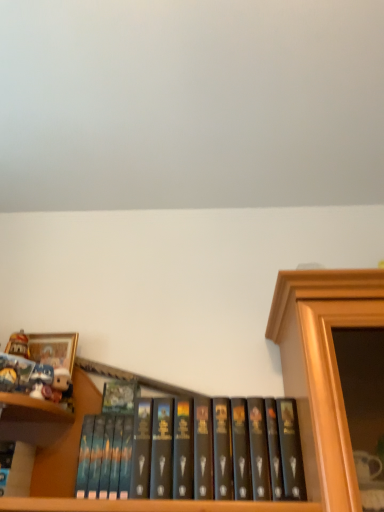
Question: Is matte white plush toy at upper left situated inside gold-framed picture at upper left or outside?

Choices:
 (A) outside
 (B) inside

Answer: (A)

Question: Would you say matte white plush toy at upper left is to the left or to the right of gold-framed picture at upper left in the picture?

Choices:
 (A) right
 (B) left

Answer: (A)

Question: Which of these objects is positioned farthest from the matte white plush toy at upper left?

Choices:
 (A) hardcover book at left, placed as the 2th book when sorted from bottom to top
 (B) gold-framed picture at upper left
 (C) black matte book at center, arranged as the 2th book when viewed from the left

Answer: (C)

Question: Based on their relative distances, which object is farther from the gold-framed picture at upper left?

Choices:
 (A) matte white plush toy at upper left
 (B) hardcover book at left, placed as the 1th book when sorted from left to right
 (C) black matte book at center, the 1th book from the bottom

Answer: (C)